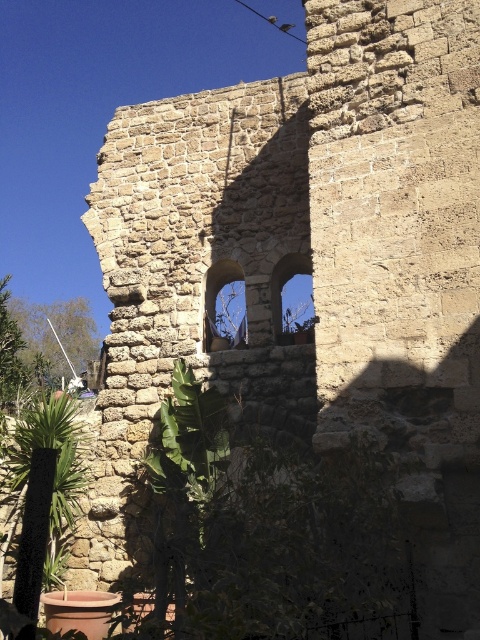
You are a delivery person with a package that is 3 meters long. You need to deliver it through one of the two windows. The stone window at center and the transparent glass window at upper center. Which window can you use to pass the package through?

The stone window at center is 3.46 meters from the transparent glass window at upper center. Since the package is 3 meters long, you can use either window as both are likely larger than the package. However, the exact dimensions of the windows aren

You are standing in front of the weathered stone wall with the green leafy plant at lower left and the transparent glass window at upper center. Which object is closer to the ground?

The green leafy plant at lower left is closer to the ground because it is positioned below the transparent glass window at upper center.

You are a gardener trying to place a new small potted plant between the green leafy plant at lower left and the stone window at center. Based on their widths, can you determine if there will be enough space for the new plant?

The green leafy plant at lower left might be wider than stone window at center, so there may not be enough space for the new plant between them.